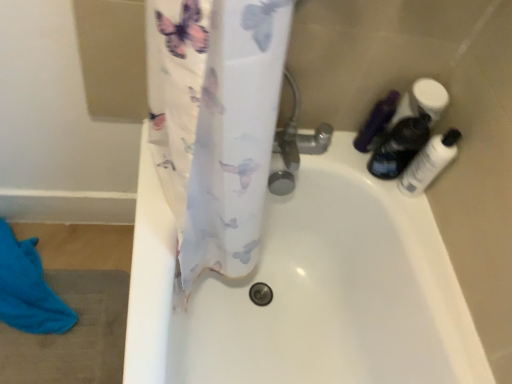
This screenshot has height=384, width=512. Identify the location of transparent plastic bottle at right, marked as the third toiletry in a left-to-right arrangement. (429, 163).

The width and height of the screenshot is (512, 384). Describe the element at coordinates (28, 289) in the screenshot. I see `blue cotton beach towel at lower left` at that location.

The height and width of the screenshot is (384, 512). Describe the element at coordinates (376, 122) in the screenshot. I see `matte black bottle at upper right, placed as the 3th toiletry when sorted from right to left` at that location.

At what (x,y) coordinates should I click in order to perform the action: click on transparent plastic bottle at right, marked as the 1th toiletry in a right-to-left arrangement. Please return your answer as a coordinate pair (x, y). Looking at the image, I should click on (429, 163).

From the image's perspective, which is above, transparent plastic bottle at right, marked as the 1th toiletry in a right-to-left arrangement, or blue cotton beach towel at lower left?

transparent plastic bottle at right, marked as the 1th toiletry in a right-to-left arrangement, from the image's perspective.

This screenshot has width=512, height=384. Find the location of `the 1st toiletry above when counting from the blue cotton beach towel at lower left (from the image's perspective)`. the 1st toiletry above when counting from the blue cotton beach towel at lower left (from the image's perspective) is located at coordinates (429, 163).

From a real-world perspective, between transparent plastic bottle at right, marked as the 1th toiletry in a right-to-left arrangement, and blue cotton beach towel at lower left, who is vertically lower?

blue cotton beach towel at lower left, from a real-world perspective.

Is transparent plastic bottle at right, marked as the 1th toiletry in a right-to-left arrangement, shorter than blue cotton beach towel at lower left?

No.

Is translucent plastic bottles at upper right, which is the 2th toiletry in right-to-left order, facing away from blue cotton beach towel at lower left?

No.

How distant is translucent plastic bottles at upper right, which is the 2th toiletry in right-to-left order, from blue cotton beach towel at lower left?

1.02 meters.

In the scene shown: Who is more distant, translucent plastic bottles at upper right, the 2th toiletry in the left-to-right sequence, or blue cotton beach towel at lower left?

blue cotton beach towel at lower left is further from the camera.

Based on their sizes in the image, would you say matte black bottle at upper right, placed as the 3th toiletry when sorted from right to left, is bigger or smaller than translucent plastic bottles at upper right, the 2th toiletry in the left-to-right sequence?

In the image, matte black bottle at upper right, placed as the 3th toiletry when sorted from right to left, appears to be smaller than translucent plastic bottles at upper right, the 2th toiletry in the left-to-right sequence.

From the picture: From the image's perspective, which one is positioned higher, matte black bottle at upper right, the 1th toiletry from the left, or translucent plastic bottles at upper right, which is the 2th toiletry in right-to-left order?

translucent plastic bottles at upper right, which is the 2th toiletry in right-to-left order, from the image's perspective.

Between matte black bottle at upper right, the 1th toiletry from the left, and translucent plastic bottles at upper right, which is the 2th toiletry in right-to-left order, which one has smaller width?

matte black bottle at upper right, the 1th toiletry from the left, is thinner.

How different are the orientations of translucent plastic bottles at upper right, the 2th toiletry in the left-to-right sequence, and matte black bottle at upper right, placed as the 3th toiletry when sorted from right to left, in degrees?

The angle between the facing direction of translucent plastic bottles at upper right, the 2th toiletry in the left-to-right sequence, and the facing direction of matte black bottle at upper right, placed as the 3th toiletry when sorted from right to left, is 3.05 degrees.

Which object is closer to the camera taking this photo, translucent plastic bottles at upper right, which is the 2th toiletry in right-to-left order, or matte black bottle at upper right, placed as the 3th toiletry when sorted from right to left?

translucent plastic bottles at upper right, which is the 2th toiletry in right-to-left order, is more forward.

From a real-world perspective, between translucent plastic bottles at upper right, which is the 2th toiletry in right-to-left order, and matte black bottle at upper right, placed as the 3th toiletry when sorted from right to left, who is vertically higher?

translucent plastic bottles at upper right, which is the 2th toiletry in right-to-left order, from a real-world perspective.

Find the location of a particular element. The height and width of the screenshot is (384, 512). the 1st toiletry in front of the matte black bottle at upper right, the 1th toiletry from the left is located at coordinates (409, 137).

Is transparent plastic bottle at right, marked as the 1th toiletry in a right-to-left arrangement, situated inside translucent plastic bottles at upper right, which is the 2th toiletry in right-to-left order, or outside?

The correct answer is: outside.

Can you confirm if transparent plastic bottle at right, marked as the 1th toiletry in a right-to-left arrangement, is taller than translucent plastic bottles at upper right, which is the 2th toiletry in right-to-left order?

No.

Who is bigger, transparent plastic bottle at right, marked as the 1th toiletry in a right-to-left arrangement, or translucent plastic bottles at upper right, which is the 2th toiletry in right-to-left order?

With larger size is translucent plastic bottles at upper right, which is the 2th toiletry in right-to-left order.

From the picture: Relative to translucent plastic bottles at upper right, which is the 2th toiletry in right-to-left order, is transparent plastic bottle at right, marked as the 1th toiletry in a right-to-left arrangement, in front or behind?

In the image, transparent plastic bottle at right, marked as the 1th toiletry in a right-to-left arrangement, appears in front of translucent plastic bottles at upper right, which is the 2th toiletry in right-to-left order.

From the image's perspective, who appears lower, blue cotton beach towel at lower left or translucent plastic bottles at upper right, the 2th toiletry in the left-to-right sequence?

blue cotton beach towel at lower left, from the image's perspective.

From a real-world perspective, which object stands above the other?

In real-world perspective, translucent plastic bottles at upper right, which is the 2th toiletry in right-to-left order, is above.

Does blue cotton beach towel at lower left come in front of translucent plastic bottles at upper right, the 2th toiletry in the left-to-right sequence?

No, it is behind translucent plastic bottles at upper right, the 2th toiletry in the left-to-right sequence.

Does point (64, 330) come in front of point (392, 108)?

That is False.

Which is correct: blue cotton beach towel at lower left is inside transparent plastic bottle at right, marked as the 1th toiletry in a right-to-left arrangement, or outside of it?

blue cotton beach towel at lower left is not inside transparent plastic bottle at right, marked as the 1th toiletry in a right-to-left arrangement, it's outside.

Looking at this image, measure the distance from blue cotton beach towel at lower left to transparent plastic bottle at right, marked as the third toiletry in a left-to-right arrangement.

They are 3.46 feet apart.

From the image's perspective, who appears lower, blue cotton beach towel at lower left or transparent plastic bottle at right, marked as the 1th toiletry in a right-to-left arrangement?

blue cotton beach towel at lower left, from the image's perspective.

Which point is more distant from viewer, (71, 322) or (423, 149)?

The point (71, 322) is more distant.

Image resolution: width=512 pixels, height=384 pixels. There is a blue cotton beach towel at lower left. In order to click on the 1st toiletry above it (from the image's perspective) in this screenshot , I will do `click(429, 163)`.

Locate an element on the screen. beach towel directly beneath the translucent plastic bottles at upper right, the 2th toiletry in the left-to-right sequence (from a real-world perspective) is located at coordinates (28, 289).

Looking at the image, which one is located further to matte black bottle at upper right, the 1th toiletry from the left, blue cotton beach towel at lower left or transparent plastic bottle at right, marked as the 1th toiletry in a right-to-left arrangement?

blue cotton beach towel at lower left.

Estimate the real-world distances between objects in this image. Which object is closer to matte black bottle at upper right, placed as the 3th toiletry when sorted from right to left, translucent plastic bottles at upper right, the 2th toiletry in the left-to-right sequence, or blue cotton beach towel at lower left?

translucent plastic bottles at upper right, the 2th toiletry in the left-to-right sequence, is positioned closer to the anchor matte black bottle at upper right, placed as the 3th toiletry when sorted from right to left.

Based on their spatial positions, is matte black bottle at upper right, placed as the 3th toiletry when sorted from right to left, or translucent plastic bottles at upper right, which is the 2th toiletry in right-to-left order, further from transparent plastic bottle at right, marked as the third toiletry in a left-to-right arrangement?

The object further to transparent plastic bottle at right, marked as the third toiletry in a left-to-right arrangement, is matte black bottle at upper right, placed as the 3th toiletry when sorted from right to left.

Which object lies further to the anchor point translucent plastic bottles at upper right, which is the 2th toiletry in right-to-left order, transparent plastic bottle at right, marked as the 1th toiletry in a right-to-left arrangement, or blue cotton beach towel at lower left?

blue cotton beach towel at lower left lies further to translucent plastic bottles at upper right, which is the 2th toiletry in right-to-left order, than the other object.

Which object lies nearer to the anchor point translucent plastic bottles at upper right, which is the 2th toiletry in right-to-left order, matte black bottle at upper right, the 1th toiletry from the left, or transparent plastic bottle at right, marked as the 1th toiletry in a right-to-left arrangement?

transparent plastic bottle at right, marked as the 1th toiletry in a right-to-left arrangement.

From the picture: Considering their positions, is blue cotton beach towel at lower left positioned further to transparent plastic bottle at right, marked as the 1th toiletry in a right-to-left arrangement, than translucent plastic bottles at upper right, which is the 2th toiletry in right-to-left order?

blue cotton beach towel at lower left is further to transparent plastic bottle at right, marked as the 1th toiletry in a right-to-left arrangement.

Based on their spatial positions, is matte black bottle at upper right, the 1th toiletry from the left, or translucent plastic bottles at upper right, the 2th toiletry in the left-to-right sequence, further from blue cotton beach towel at lower left?

translucent plastic bottles at upper right, the 2th toiletry in the left-to-right sequence, lies further to blue cotton beach towel at lower left than the other object.

From the picture: Which object lies further to the anchor point blue cotton beach towel at lower left, matte black bottle at upper right, the 1th toiletry from the left, or transparent plastic bottle at right, marked as the third toiletry in a left-to-right arrangement?

Among the two, transparent plastic bottle at right, marked as the third toiletry in a left-to-right arrangement, is located further to blue cotton beach towel at lower left.

Locate an element on the screen. The image size is (512, 384). toiletry located between blue cotton beach towel at lower left and translucent plastic bottles at upper right, the 2th toiletry in the left-to-right sequence, in the left-right direction is located at coordinates (376, 122).

Where is `toiletry between translucent plastic bottles at upper right, the 2th toiletry in the left-to-right sequence, and transparent plastic bottle at right, marked as the 1th toiletry in a right-to-left arrangement, from top to bottom`? This screenshot has width=512, height=384. toiletry between translucent plastic bottles at upper right, the 2th toiletry in the left-to-right sequence, and transparent plastic bottle at right, marked as the 1th toiletry in a right-to-left arrangement, from top to bottom is located at coordinates (376, 122).